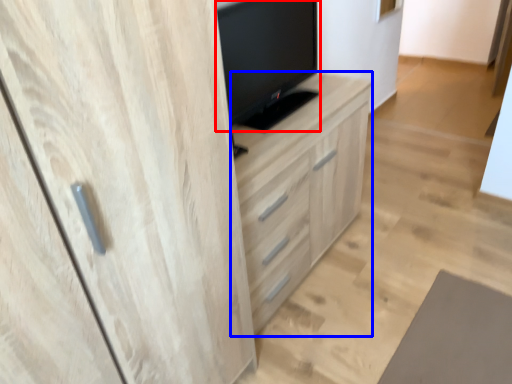
Question: Which object appears farthest to the camera in this image, television (highlighted by a red box) or chest of drawers (highlighted by a blue box)?

Choices:
 (A) television
 (B) chest of drawers

Answer: (B)